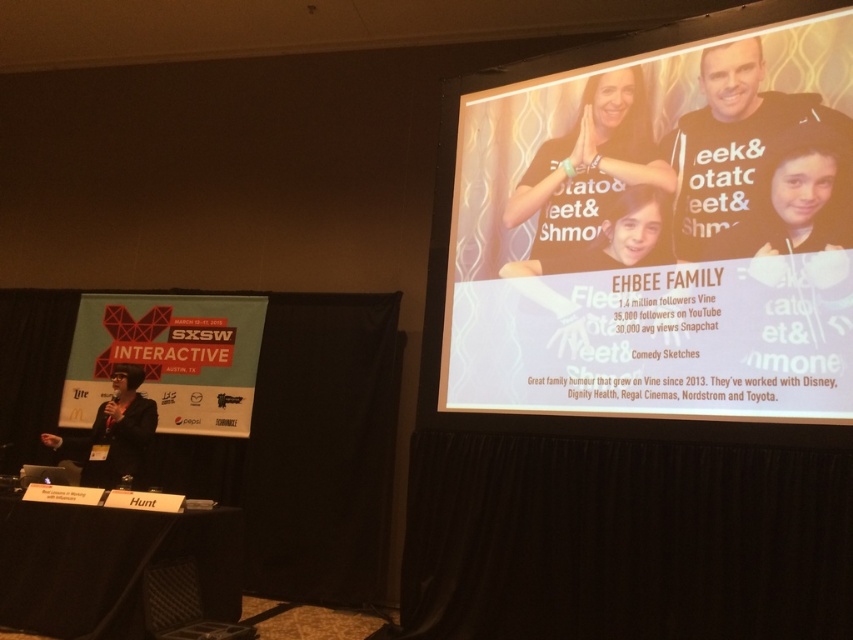
You are attending the SXSW Interactive event and want to move from the point at coordinates point [606,150] to the point at coordinates point [219,333]. Which direction should you move in to reach your destination?

To move from point [606,150] to point [219,333], you should move towards the lower right direction since point [219,333] is behind point [606,150].